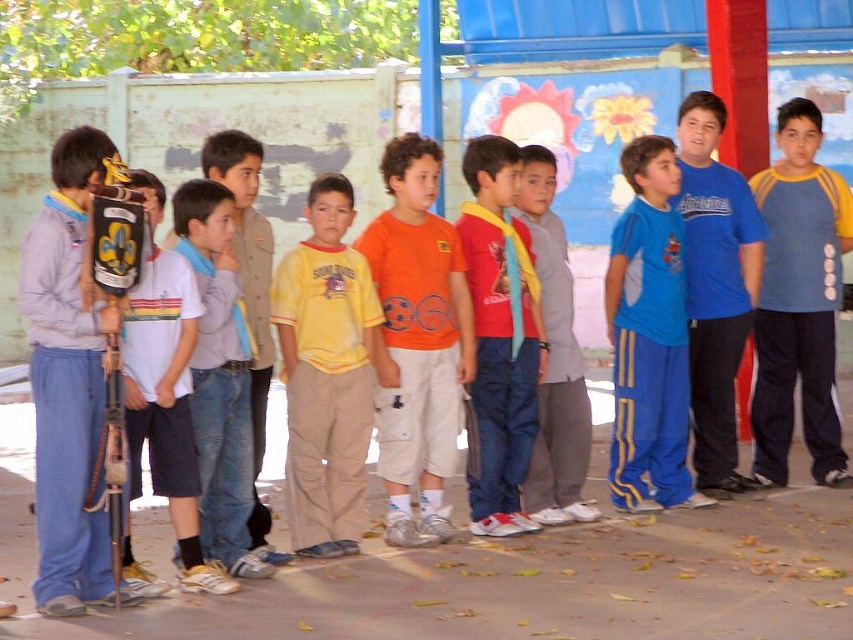
Between blue jersey at center and gray cotton pants at center, which one has less height?

With less height is gray cotton pants at center.

Is blue jersey at center positioned behind gray cotton pants at center?

That is True.

Between point (693, 138) and point (531, 472), which one is positioned in front?

Positioned in front is point (531, 472).

Identify the location of blue jersey at center. This screenshot has height=640, width=853. (x=715, y=285).

Between point (367, 240) and point (685, 378), which one is positioned in front?

Point (367, 240)

Identify the location of orange cotton t-shirt at center. Image resolution: width=853 pixels, height=640 pixels. (418, 339).

Does white matte shirt at left have a larger size compared to gray cotton pants at center?

No, white matte shirt at left is not bigger than gray cotton pants at center.

Is white matte shirt at left taller than gray cotton pants at center?

Incorrect, white matte shirt at left's height is not larger of gray cotton pants at center's.

Which is behind, point (186, 464) or point (552, 339)?

The point (552, 339) is behind.

Where is `white matte shirt at left`? The image size is (853, 640). white matte shirt at left is located at coordinates (167, 403).